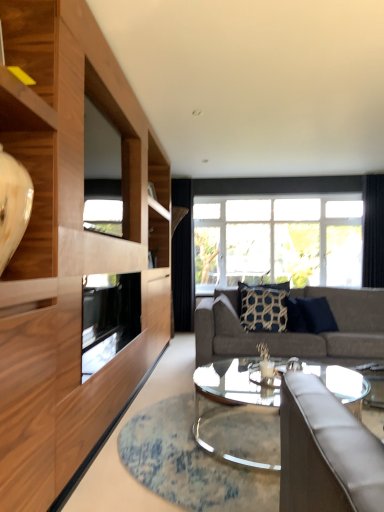
Question: From a real-world perspective, is gray fabric couch at center physically located above or below navy blue textured pillow at center, which is counted as the second pillow, starting from the right?

Choices:
 (A) above
 (B) below

Answer: (B)

Question: Which is correct: gray fabric couch at center is inside navy blue textured pillow at center, which is counted as the second pillow, starting from the right, or outside of it?

Choices:
 (A) inside
 (B) outside

Answer: (B)

Question: Estimate the real-world distances between objects in this image. Which object is closer to the dark blue textured pillow at center, positioned as the 2th pillow in left-to-right order?

Choices:
 (A) transparent glass window screen at upper left
 (B) clear glass coffee table at center
 (C) shiny white vase at left
 (D) navy blue textured pillow at center, which is counted as the second pillow, starting from the right
 (E) wooden cabinet at left

Answer: (D)

Question: Which of these objects is positioned farthest from the black fabric curtain at right?

Choices:
 (A) clear glass coffee table at center
 (B) navy blue textured pillow at center, which is counted as the second pillow, starting from the right
 (C) gray fabric couch at center
 (D) shiny white vase at left
 (E) clear glass window at center

Answer: (D)